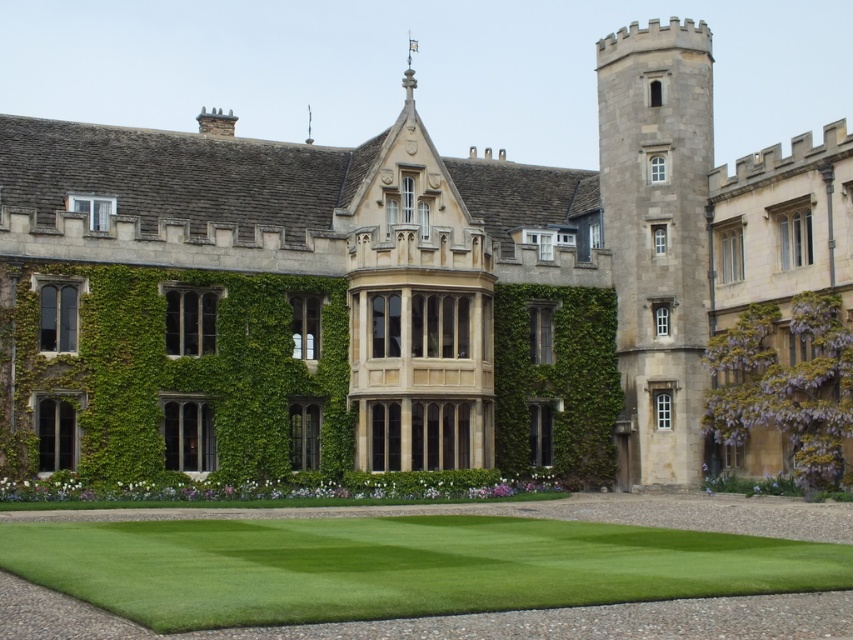
Question: Which point is closer to the camera?

Choices:
 (A) (639, 173)
 (B) (567, 433)
 (C) (840, 436)
 (D) (155, 604)

Answer: (D)

Question: Can you confirm if stone tower at center right is thinner than purple leafy hedge at right?

Choices:
 (A) yes
 (B) no

Answer: (B)

Question: Can you confirm if green lawn at lower center is positioned to the right of purple leafy hedge at right?

Choices:
 (A) yes
 (B) no

Answer: (B)

Question: Which is farther from the green ivy wall at center?

Choices:
 (A) purple leafy hedge at right
 (B) green lawn at lower center

Answer: (B)

Question: Is stone tower at center right positioned at the back of green ivy wall at center?

Choices:
 (A) no
 (B) yes

Answer: (B)

Question: Which point is farther from the camera taking this photo?

Choices:
 (A) (828, 308)
 (B) (566, 468)

Answer: (B)